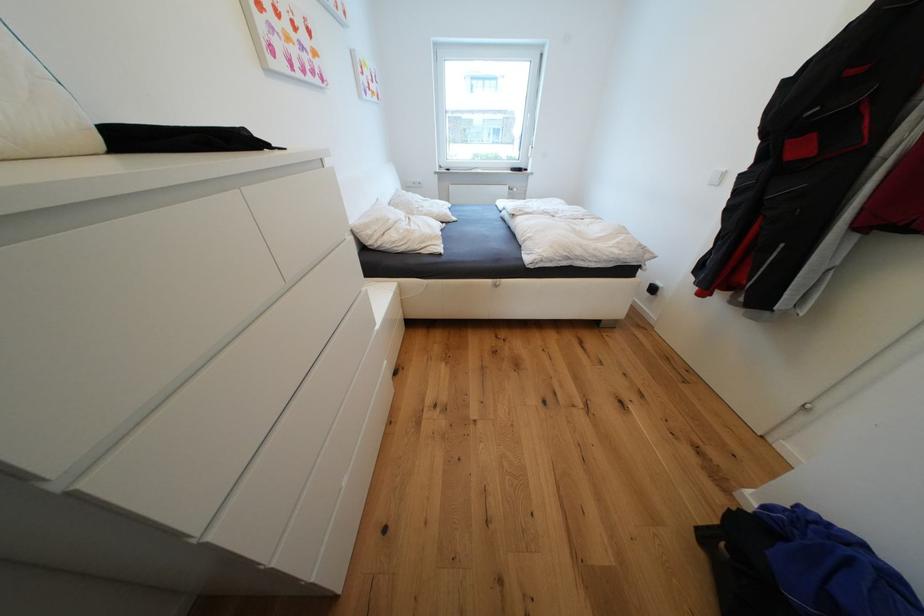
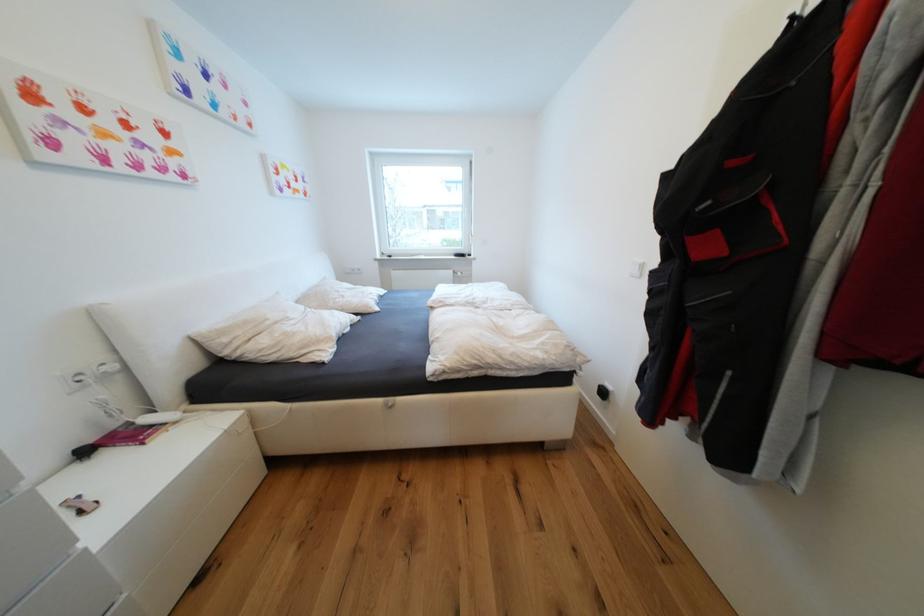
Question: How did the camera likely rotate?

Choices:
 (A) Left
 (B) Right
 (C) Up
 (D) Down

Answer: (C)